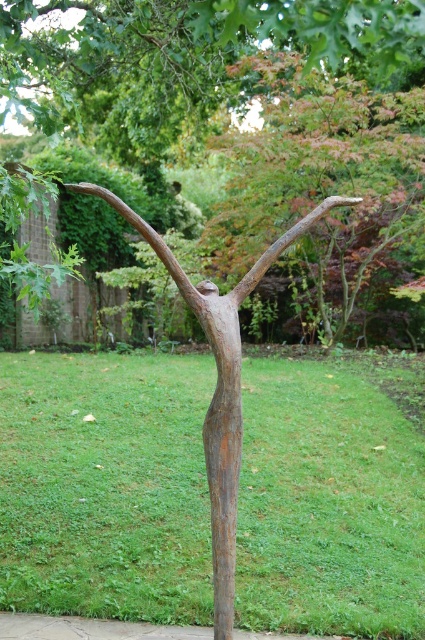
You are standing in the garden and want to take a photo of both the rusty metal tree at center and the brown rough tree trunk at center. Which one should you move to the left to frame them both in the photo?

You should move the rusty metal tree at center to the left since it is currently on the right side of the brown rough tree trunk at center, so shifting it left would help frame both in the photo.

You are a gardener planning to place a new bench in the garden. The bench is 1.2 meters wide. You want to place it between the rusty metal tree at center and the brown rough tree trunk at center. Can the bench fit between them?

The rusty metal tree at center is wider than the brown rough tree trunk at center. The bench requires 1.2 meters of space, but the available space between them is not specified. Without knowing the exact distance between the two trees, it is impossible to determine if the bench will fit.

You are a bird looking for a higher perch to survey the garden. You see the rusty metal tree at center and the brown rough tree trunk at center. Which one should you choose to get a better view?

The rusty metal tree at center is much taller than the brown rough tree trunk at center, so you should choose the rusty metal tree at center to get a better view.